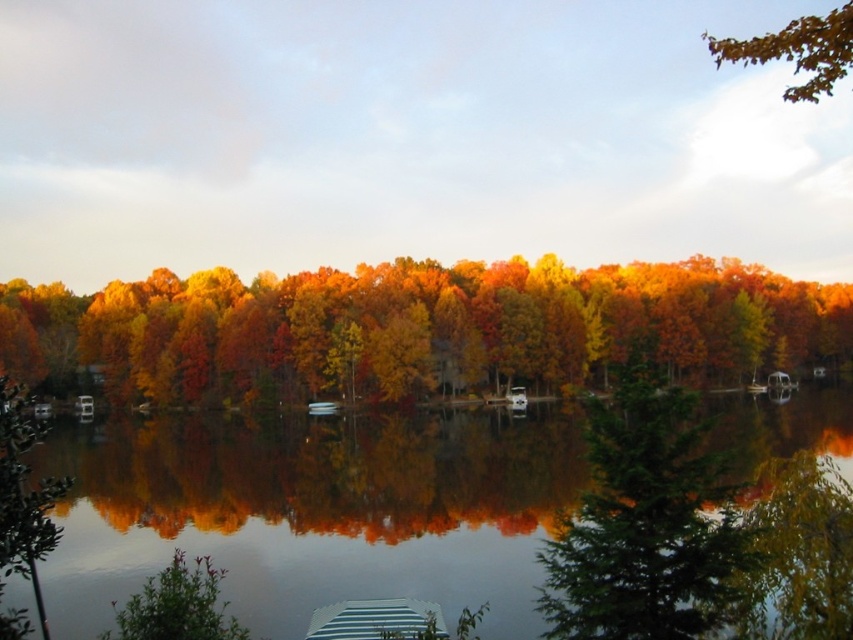
Who is shorter, transparent water at center or brown matte leaves at upper right?

transparent water at center

Measure the distance from transparent water at center to brown matte leaves at upper right.

The distance of transparent water at center from brown matte leaves at upper right is 46.83 meters.

Identify the location of transparent water at center. The width and height of the screenshot is (853, 640). (312, 512).

Is point (479, 342) less distant than point (1, 493)?

No, (479, 342) is further to viewer.

Where is `orange matte tree at center`? The image size is (853, 640). orange matte tree at center is located at coordinates (416, 324).

Between point (798, 284) and point (20, 467), which one is positioned behind?

Point (798, 284)

Find the location of a particular element. The image size is (853, 640). orange matte tree at center is located at coordinates (416, 324).

Does transparent water at center have a smaller size compared to orange matte tree at center?

Yes.

Which is in front, point (73, 472) or point (115, 353)?

Point (73, 472) is more forward.

Does point (527, 444) lie behind point (399, 396)?

No, (527, 444) is closer to viewer.

This screenshot has width=853, height=640. Find the location of `transparent water at center`. transparent water at center is located at coordinates (312, 512).